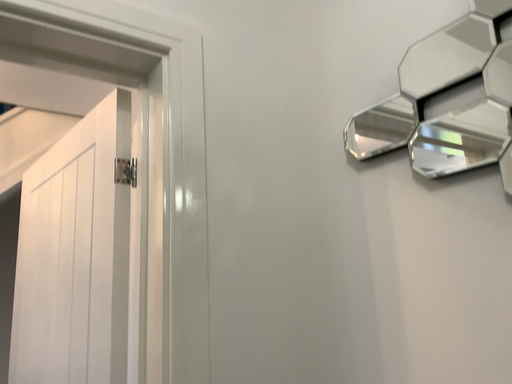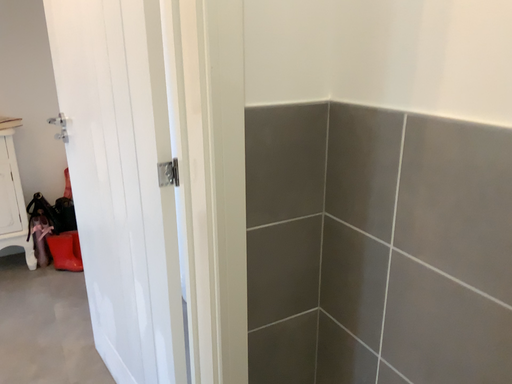
Question: Which way did the camera rotate in the video?

Choices:
 (A) rotated downward
 (B) rotated upward

Answer: (A)